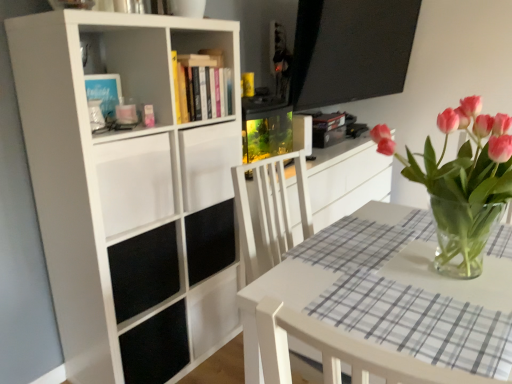
Image resolution: width=512 pixels, height=384 pixels. I want to click on vacant area on top of white glossy table at center (from a real-world perspective), so click(x=383, y=268).